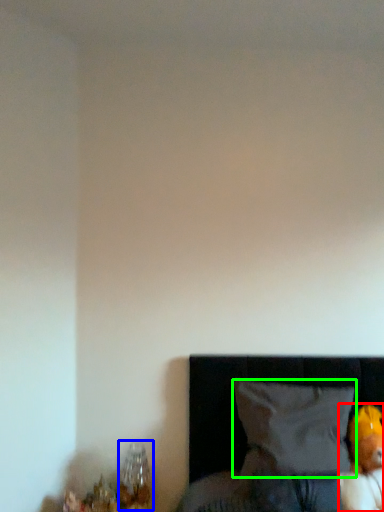
Question: Considering the real-world distances, which object is farthest from toy (highlighted by a red box)? table lamp (highlighted by a blue box) or pillow (highlighted by a green box)?

Choices:
 (A) table lamp
 (B) pillow

Answer: (A)